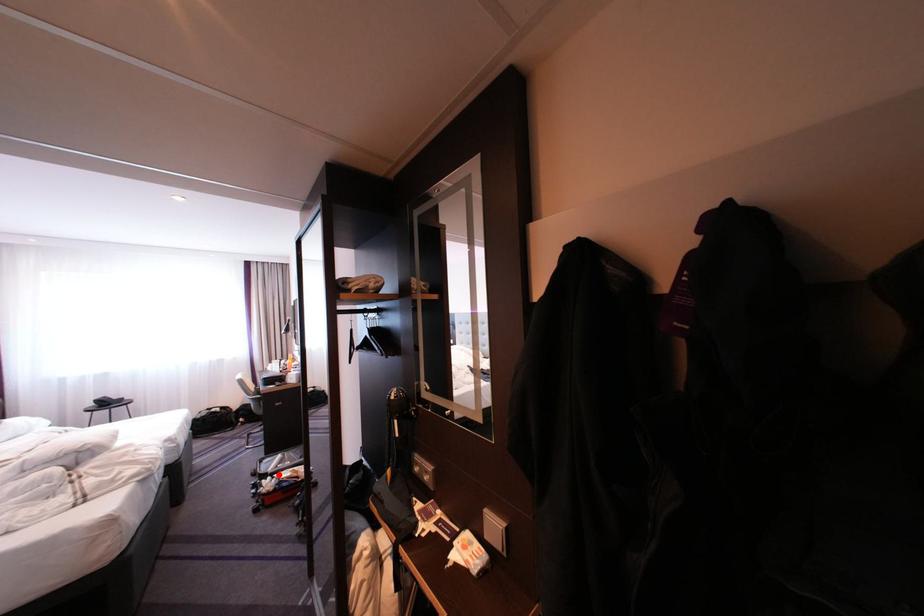
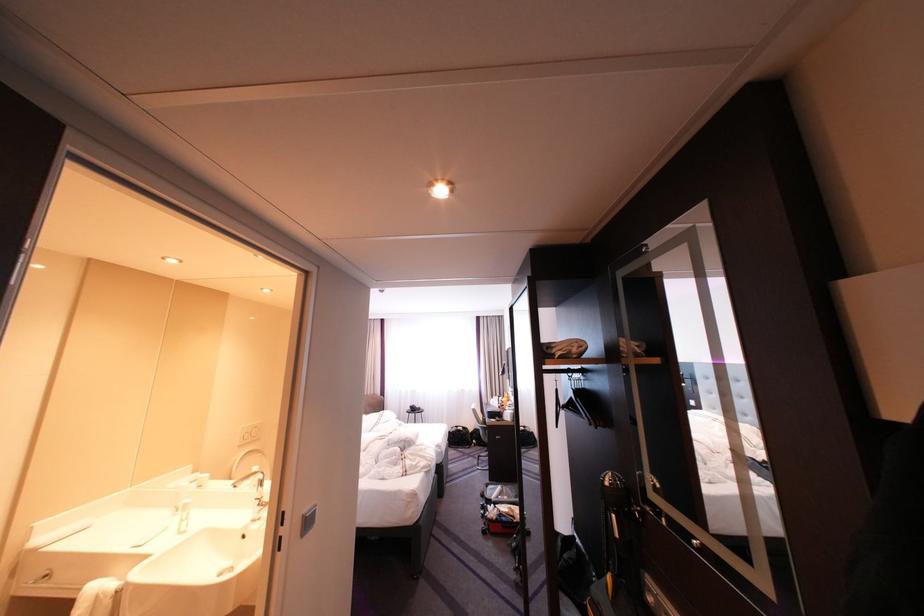
Question: A red point is marked in image1. In image2, is the corresponding 3D point closer to the camera or farther? Reply with the corresponding letter.

Choices:
 (A) The corresponding 3D point is closer.
 (B) The corresponding 3D point is farther.

Answer: (A)